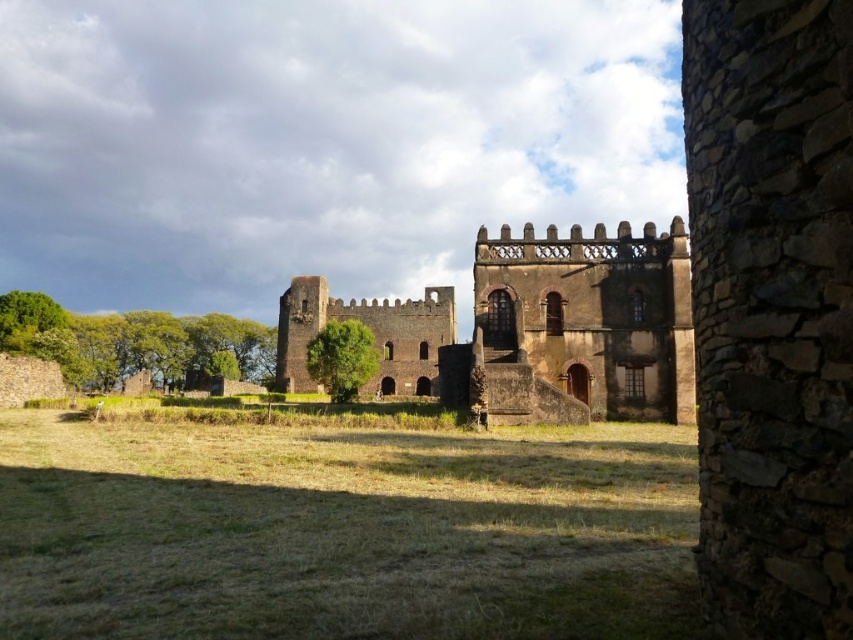
Locate an element on the screen. green grass at center is located at coordinates (343, 531).

Who is shorter, green grass at center or brown stone castle at center?

Standing shorter between the two is green grass at center.

Does point (57, 625) come behind point (402, 333)?

No.

The image size is (853, 640). What are the coordinates of `green grass at center` in the screenshot? It's located at (343, 531).